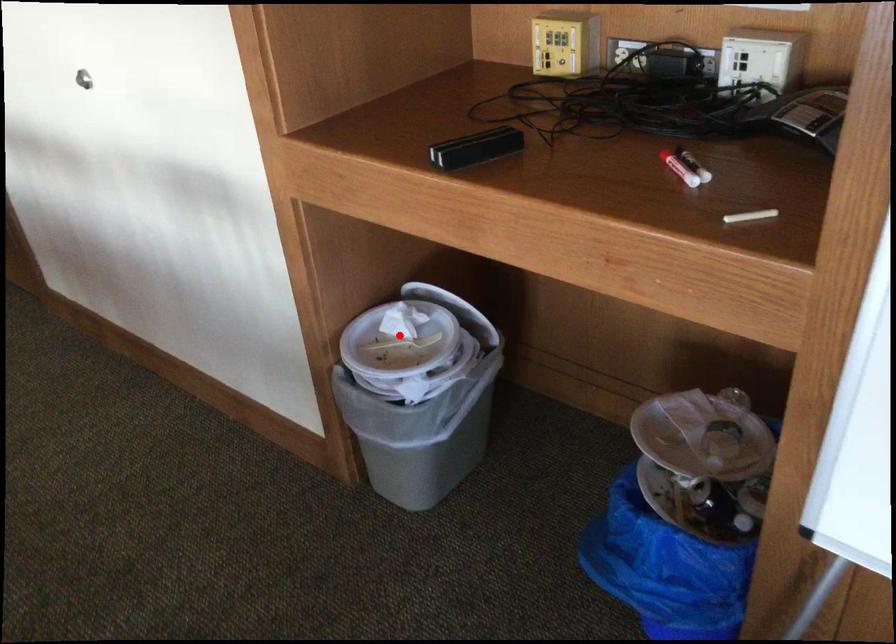
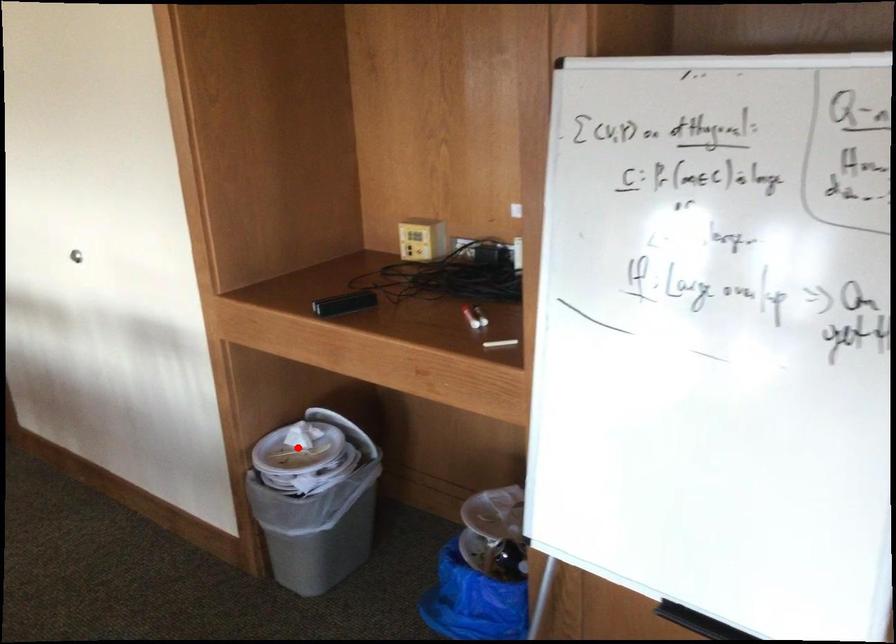
I am providing you with two images of the same scene from different viewpoints. A red point is marked on the first image and another point is marked on the second image. Is the red point in image1 aligned with the point shown in image2?

Yes